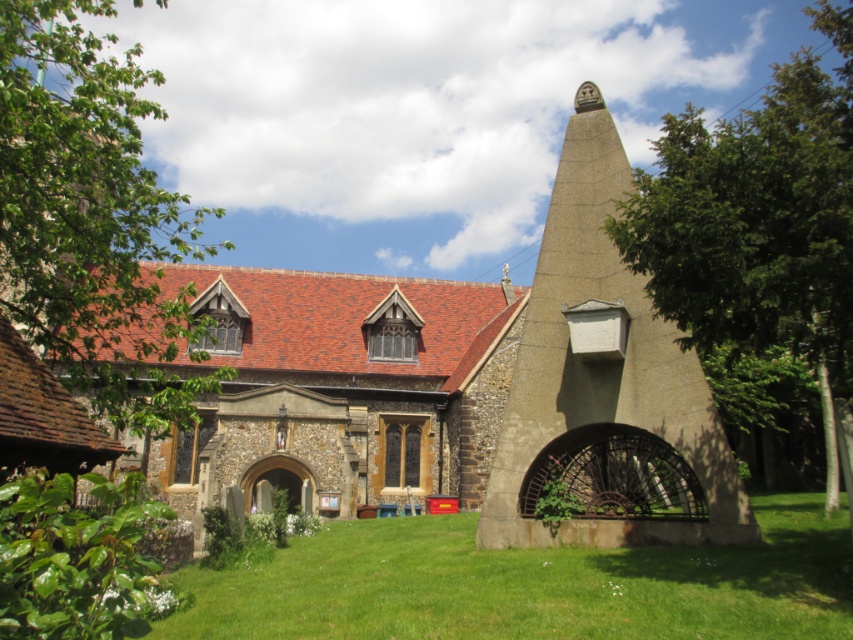
You are standing in the middle of the outdoor scene and want to walk towards the green leafy tree at right. Which direction should you turn to face the brown stone church at center?

The brown stone church at center is to the left of the green leafy tree at right. Since you want to face the brown stone church at center, you should turn to your left from the tree.

You are standing at the point with coordinates point (24, 99) and want to walk to the point (645, 440). Is there a clear path between these two points without any obstructions?

Point (645, 440) is behind point (24, 99), so there might be an obstruction between them. You might need to go around point (24, 99) to reach point (645, 440).